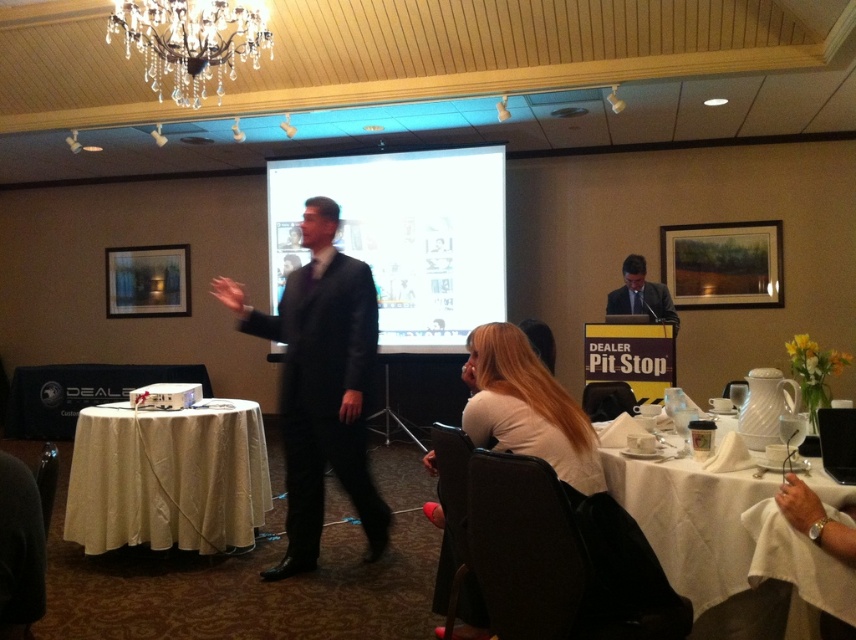
You are a stagehand setting up for a presentation. You need to ensure that the white glossy projection screen at center and the matte black suit at center are visible to the audience. Which object should be placed closer to the front to ensure visibility?

The white glossy projection screen at center should be placed closer to the front because its width surpasses that of the matte black suit at center, making it more prominent and easier to see from a distance.

You are a photographer standing at the camera position. You want to capture a clear photo of the black suit at center without any obstructions. Given that the camera has a minimum focusing distance of 2 meters, can you take the photo successfully?

The black suit at center and camera are 3.24 meters apart from each other. Since the minimum focusing distance is 2 meters, the photographer can successfully take a clear photo as the distance is sufficient.